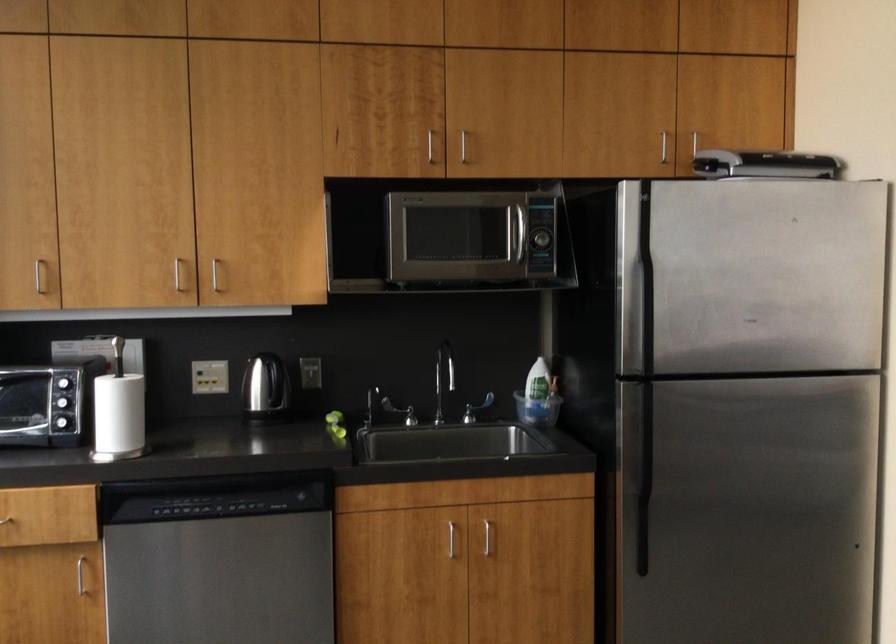
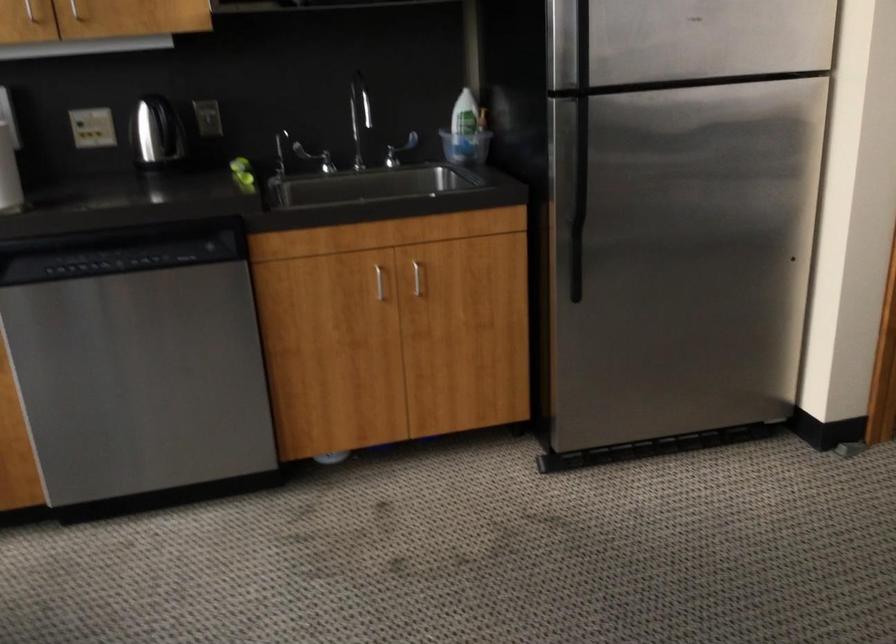
Question: What movement of the cameraman would produce the second image?

Choices:
 (A) Left
 (B) Right
 (C) Forward
 (D) Backward

Answer: (C)